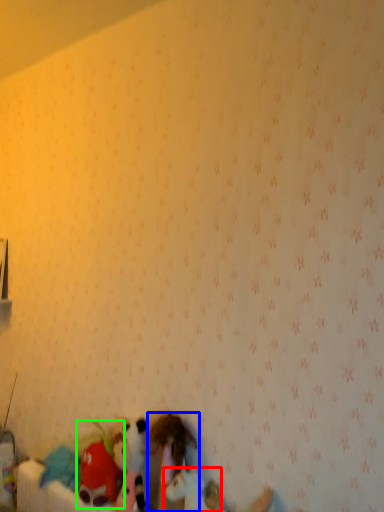
Question: Considering the real-world distances, which object is closest to toy (highlighted by a red box)? toy (highlighted by a blue box) or toy (highlighted by a green box).

Choices:
 (A) toy
 (B) toy

Answer: (A)